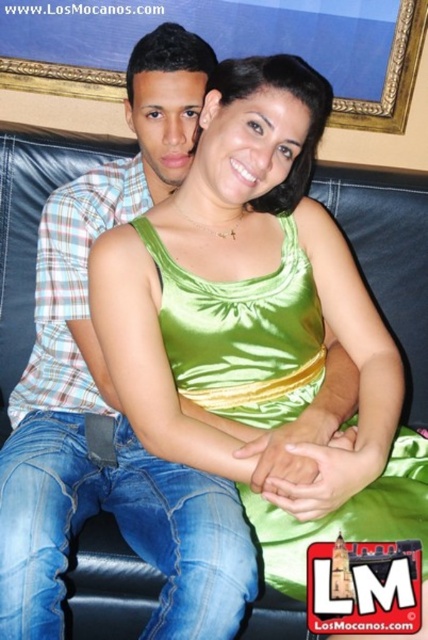
You are an interior designer analyzing the placement of objects in this living room scene. The green satin tank top at center is part of the decor. What are its exact coordinates?

The green satin tank top at center is located at the 2D coordinates point (243, 333).